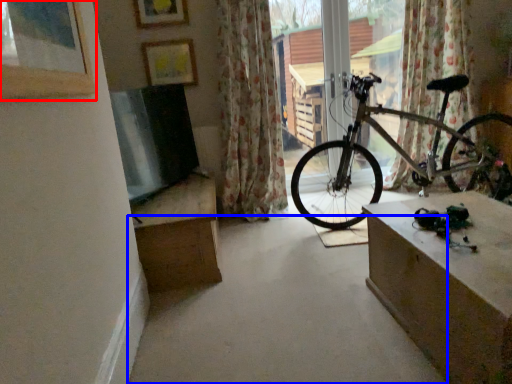
Question: Which object is closer to the camera taking this photo, picture frame (highlighted by a red box) or concrete (highlighted by a blue box)?

Choices:
 (A) picture frame
 (B) concrete

Answer: (A)